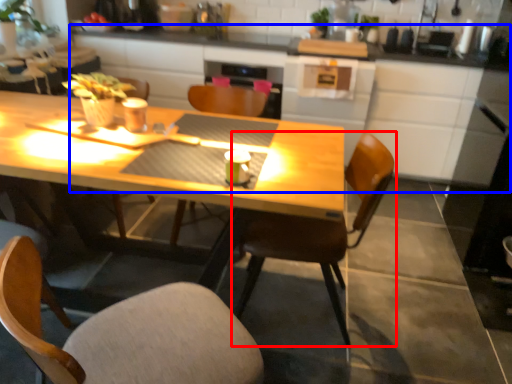
Question: Which object appears closest to the camera in this image, chair (highlighted by a red box) or counter (highlighted by a blue box)?

Choices:
 (A) chair
 (B) counter

Answer: (A)